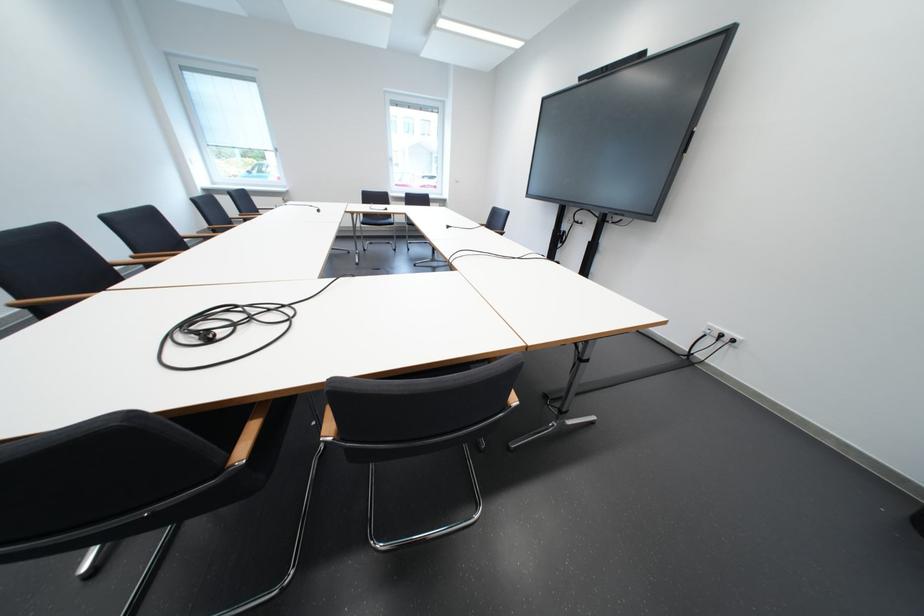
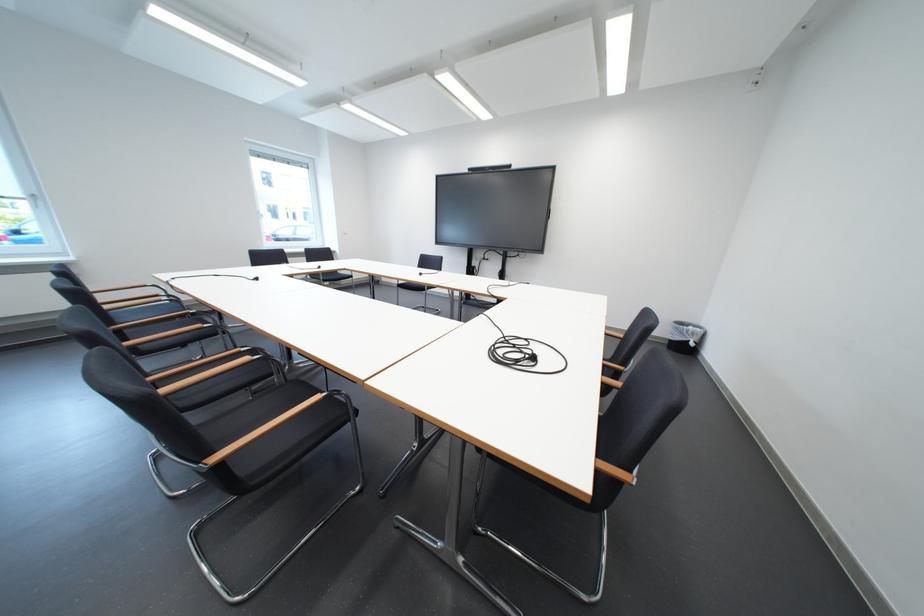
The point at (239, 313) is marked in the first image. Where is the corresponding point in the second image?

(506, 351)